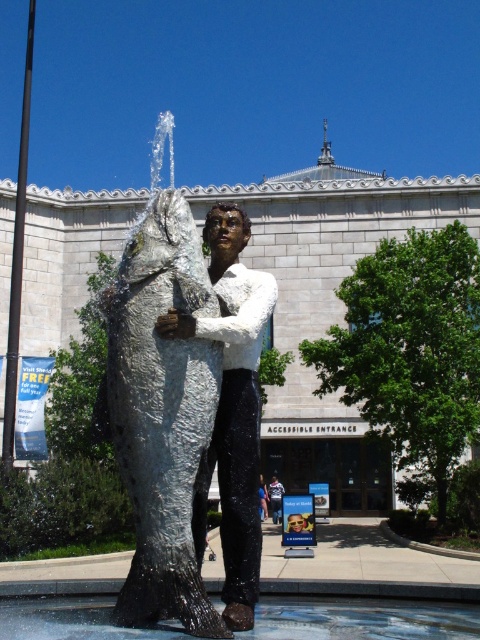
You are standing in front of the sculpture and want to take a photo of the metallic statue at center without the clear water at fountain center in the frame. Which direction should you move to ensure the water is no longer blocking the statue?

Move to the side so that the clear water at fountain center is no longer between you and the metallic statue at center.

You are an architect designing a new pathway that must pass between the shiny metallic fish at center and the metallic statue at center. What is the minimum width required for the pathway to ensure safe passage?

The minimum width required for the pathway is 41.49 meters, as the distance between the shiny metallic fish at center and the metallic statue at center is exactly 41.49 meters.

Looking at this image, you are standing in front of the sculpture and want to take a photo of both the shiny silver statue at center and the metallic statue at center. Which one should you focus on first to ensure both are in clear view?

You should focus on the shiny silver statue at center first because it is closer to the viewer than the metallic statue at center, so adjusting focus from near to far will help both be in clear view.